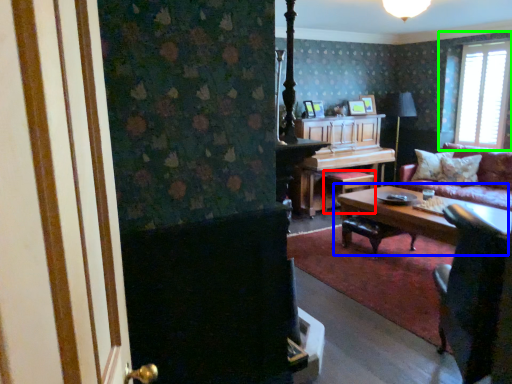
Question: Based on their relative distances, which object is nearer to stool (highlighted by a red box)? Choose from coffee table (highlighted by a blue box) and window (highlighted by a green box).

Choices:
 (A) coffee table
 (B) window

Answer: (A)